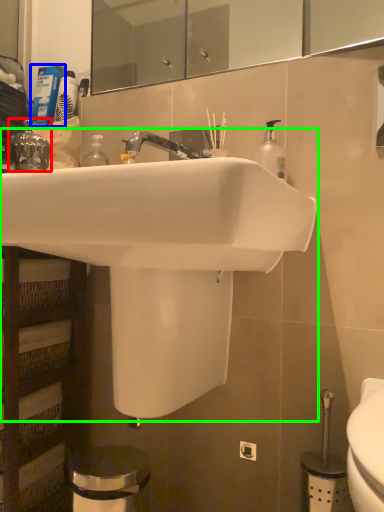
Question: Estimate the real-world distances between objects in this image. Which object is closer to plumbing fixture (highlighted by a red box), toiletry (highlighted by a blue box) or sink (highlighted by a green box)?

Choices:
 (A) toiletry
 (B) sink

Answer: (A)